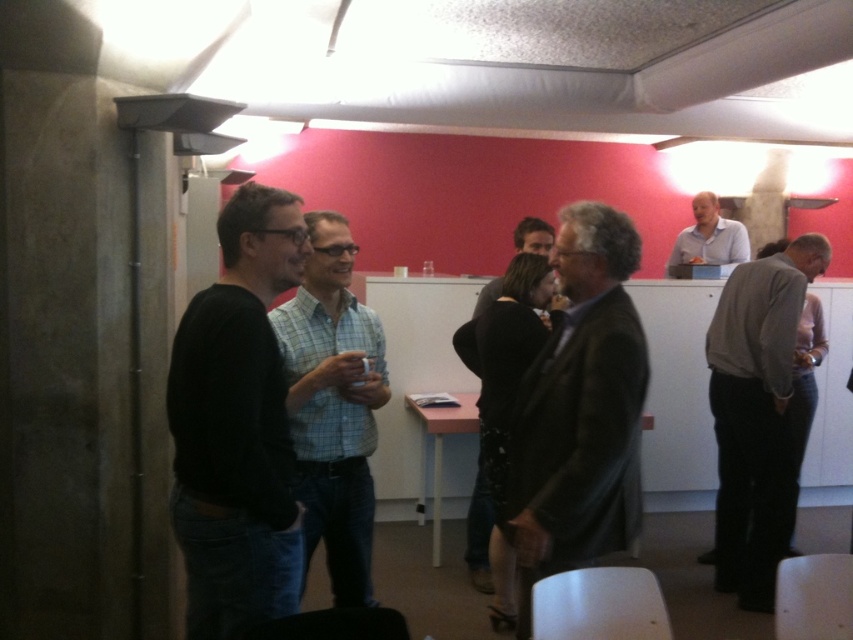
Question: Is dark brown leather jacket at center positioned in front of dark gray leather jacket at center?

Choices:
 (A) no
 (B) yes

Answer: (B)

Question: Which object is the farthest from the dark brown leather jacket at center?

Choices:
 (A) light blue shirt at upper right
 (B) gray wool sweater at right

Answer: (A)

Question: Does black matte sweater at left appear under dark brown leather jacket at center?

Choices:
 (A) yes
 (B) no

Answer: (B)

Question: Considering the real-world distances, which object is farthest from the gray wool sweater at right?

Choices:
 (A) light blue shirt at upper right
 (B) dark gray leather jacket at center
 (C) black matte sweater at left

Answer: (C)

Question: Which of the following is the farthest from the observer?

Choices:
 (A) (544, 253)
 (B) (299, 534)
 (C) (729, 256)
 (D) (628, 340)

Answer: (C)

Question: Can you confirm if light blue checkered shirt at center is positioned above dark gray leather jacket at center?

Choices:
 (A) no
 (B) yes

Answer: (A)